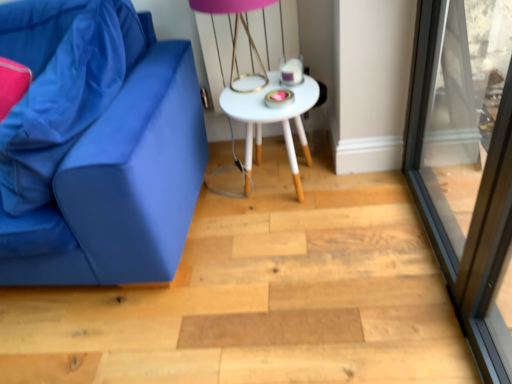
Describe the element at coordinates (466, 161) in the screenshot. I see `transparent glass screen door at right` at that location.

You are a GUI agent. You are given a task and a screenshot of the screen. Output one action in this format:
    pyautogui.click(x=<x>, y=<y>)
    Task: Click on the pink matte table lamp at upper center
    The width and height of the screenshot is (512, 384).
    Given the screenshot: What is the action you would take?
    pyautogui.click(x=236, y=30)

The width and height of the screenshot is (512, 384). What do you see at coordinates (236, 30) in the screenshot? I see `pink matte table lamp at upper center` at bounding box center [236, 30].

I want to click on matte blue couch at left, so click(130, 178).

This screenshot has height=384, width=512. In order to click on matte blue fabric pillow at left in this screenshot , I will do coord(54,89).

This screenshot has height=384, width=512. Describe the element at coordinates (54, 89) in the screenshot. I see `matte blue fabric pillow at left` at that location.

Where is `transparent glass screen door at right`? Image resolution: width=512 pixels, height=384 pixels. transparent glass screen door at right is located at coordinates (466, 161).

Find the location of `studio couch below the transparent glass screen door at right (from a real-world perspective)`. studio couch below the transparent glass screen door at right (from a real-world perspective) is located at coordinates (130, 178).

From a real-world perspective, does matte blue couch at left sit lower than transparent glass screen door at right?

Yes, from a real-world perspective, matte blue couch at left is below transparent glass screen door at right.

Relative to transparent glass screen door at right, is matte blue couch at left in front or behind?

matte blue couch at left is positioned farther from the viewer than transparent glass screen door at right.

From the image's perspective, is matte blue couch at left on top of transparent glass screen door at right?

Indeed, from the image's perspective, matte blue couch at left is shown above transparent glass screen door at right.

Based on the photo, from the image's perspective, is white matte table at center located above or below pink matte table lamp at upper center?

Based on their image positions, white matte table at center is located beneath pink matte table lamp at upper center.

Is white matte table at center far away from pink matte table lamp at upper center?

They are positioned close to each other.

Is white matte table at center not inside pink matte table lamp at upper center?

Yes, white matte table at center is not within pink matte table lamp at upper center.

In the scene shown: Is white matte table at center facing towards pink matte table lamp at upper center?

No, white matte table at center is not facing towards pink matte table lamp at upper center.

Would you say transparent glass screen door at right is a long distance from matte blue fabric pillow at left?

transparent glass screen door at right is positioned a significant distance from matte blue fabric pillow at left.

From the picture: Could you tell me if transparent glass screen door at right is facing matte blue fabric pillow at left?

Yes, transparent glass screen door at right is turned towards matte blue fabric pillow at left.

In the image, is transparent glass screen door at right on the left side or the right side of matte blue fabric pillow at left?

Clearly, transparent glass screen door at right is on the right of matte blue fabric pillow at left in the image.

Are pink matte table lamp at upper center and matte blue fabric pillow at left located far from each other?

They are positioned close to each other.

Which is behind, pink matte table lamp at upper center or matte blue fabric pillow at left?

pink matte table lamp at upper center is behind.

From the image's perspective, which is above, pink matte table lamp at upper center or matte blue fabric pillow at left?

pink matte table lamp at upper center appears higher in the image.

Is point (236, 90) less distant than point (80, 5)?

No, it is not.

Is the surface of white matte table at center in direct contact with matte blue couch at left?

No, white matte table at center is not making contact with matte blue couch at left.

Considering the sizes of white matte table at center and matte blue couch at left in the image, is white matte table at center wider or thinner than matte blue couch at left?

In the image, white matte table at center appears to be more narrow than matte blue couch at left.

Can you confirm if white matte table at center is shorter than matte blue couch at left?

Yes.

Is matte blue couch at left a part of white matte table at center?

No, matte blue couch at left is not inside white matte table at center.

Which object is positioned more to the left, matte blue couch at left or pink matte table lamp at upper center?

Positioned to the left is matte blue couch at left.

Considering their positions, is matte blue couch at left located in front of or behind pink matte table lamp at upper center?

A: matte blue couch at left is in front of pink matte table lamp at upper center.

Where is `table lamp that appears above the matte blue couch at left (from the image's perspective)`? This screenshot has height=384, width=512. table lamp that appears above the matte blue couch at left (from the image's perspective) is located at coordinates (236, 30).

Do you think matte blue couch at left is within pink matte table lamp at upper center, or outside of it?

matte blue couch at left lies outside pink matte table lamp at upper center.

From the picture: In terms of height, does matte blue couch at left look taller or shorter compared to white matte table at center?

Considering their sizes, matte blue couch at left has more height than white matte table at center.

From the image's perspective, would you say matte blue couch at left is shown under white matte table at center?

Yes, from the image's perspective, matte blue couch at left is beneath white matte table at center.

Between matte blue couch at left and white matte table at center, which one has smaller width?

white matte table at center is thinner.

Where is `screen door above the matte blue couch at left (from a real-world perspective)`? screen door above the matte blue couch at left (from a real-world perspective) is located at coordinates (466, 161).

This screenshot has height=384, width=512. I want to click on table on the right of pink matte table lamp at upper center, so click(x=272, y=121).

When comparing their distances from white matte table at center, does matte blue fabric pillow at left or matte blue couch at left seem further?

matte blue fabric pillow at left is further to white matte table at center.

Looking at this image, from the image, which object appears to be nearer to pink matte table lamp at upper center, white matte table at center or matte blue fabric pillow at left?

Among the two, white matte table at center is located nearer to pink matte table lamp at upper center.

When comparing their distances from white matte table at center, does pink matte table lamp at upper center or transparent glass screen door at right seem closer?

pink matte table lamp at upper center.

From the image, which object appears to be farther from matte blue couch at left, matte blue fabric pillow at left or transparent glass screen door at right?

transparent glass screen door at right.

From the image, which object appears to be nearer to transparent glass screen door at right, matte blue couch at left or white matte table at center?

Among the two, white matte table at center is located nearer to transparent glass screen door at right.

Based on their spatial positions, is matte blue couch at left or pink matte table lamp at upper center closer to matte blue fabric pillow at left?

matte blue couch at left lies closer to matte blue fabric pillow at left than the other object.

Which object lies further to the anchor point transparent glass screen door at right, white matte table at center or pink matte table lamp at upper center?

The object further to transparent glass screen door at right is pink matte table lamp at upper center.

When comparing their distances from pink matte table lamp at upper center, does white matte table at center or transparent glass screen door at right seem further?

→ Based on the image, transparent glass screen door at right appears to be further to pink matte table lamp at upper center.

Identify the location of table lamp between transparent glass screen door at right and white matte table at center from front to back. (236, 30).

Where is `table lamp between matte blue couch at left and transparent glass screen door at right`? This screenshot has width=512, height=384. table lamp between matte blue couch at left and transparent glass screen door at right is located at coordinates (236, 30).

This screenshot has height=384, width=512. I want to click on table lamp between matte blue fabric pillow at left and white matte table at center in the horizontal direction, so click(236, 30).

Where is `pillow situated between matte blue couch at left and transparent glass screen door at right from left to right`? The height and width of the screenshot is (384, 512). pillow situated between matte blue couch at left and transparent glass screen door at right from left to right is located at coordinates (54, 89).